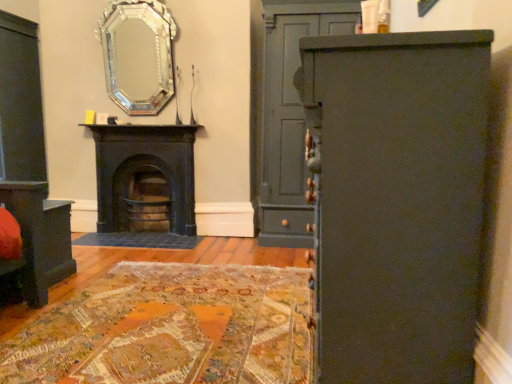
Question: Based on their sizes in the image, would you say matte black vanity at lower left is bigger or smaller than matte gray cabinet at right?

Choices:
 (A) big
 (B) small

Answer: (B)

Question: Do you think matte black vanity at lower left is within matte gray cabinet at right, or outside of it?

Choices:
 (A) inside
 (B) outside

Answer: (B)

Question: Based on their relative distances, which object is nearer to the matte gray cabinet at right?

Choices:
 (A) matte black vanity at lower left
 (B) black cast iron fireplace at center
 (C) silver/glass mirror at upper center
 (D) matte black cabinet at right

Answer: (B)

Question: Based on their relative distances, which object is nearer to the matte black cabinet at right?

Choices:
 (A) silver/glass mirror at upper center
 (B) matte black vanity at lower left
 (C) black cast iron fireplace at center
 (D) matte gray cabinet at right

Answer: (B)